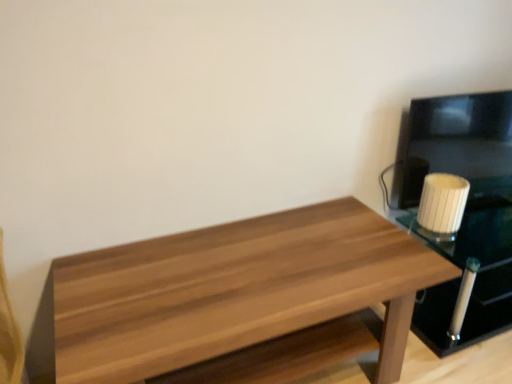
What do you see at coordinates (234, 291) in the screenshot? The image size is (512, 384). I see `wooden table at center` at bounding box center [234, 291].

In order to click on white ribbed glass at right in this screenshot , I will do `click(442, 203)`.

At what (x,y) coordinates should I click in order to perform the action: click on white glossy candle at right. Please return your answer as a coordinate pair (x, y). Image resolution: width=512 pixels, height=384 pixels. Looking at the image, I should click on (465, 210).

Where is `wooden table at center`? wooden table at center is located at coordinates (234, 291).

In terms of size, does white ribbed glass at right appear bigger or smaller than white glossy candle at right?

In the image, white ribbed glass at right appears to be smaller than white glossy candle at right.

Considering the positions of objects white ribbed glass at right and white glossy candle at right in the image provided, who is behind, white ribbed glass at right or white glossy candle at right?

white ribbed glass at right is behind.

Does white ribbed glass at right appear on the right side of white glossy candle at right?

No, white ribbed glass at right is not to the right of white glossy candle at right.

Could you tell me if white ribbed glass at right is facing white glossy candle at right?

No, white ribbed glass at right does not turn towards white glossy candle at right.

Considering the relative positions of white glossy candle at right and white ribbed glass at right in the image provided, is white glossy candle at right to the left of white ribbed glass at right from the viewer's perspective?

In fact, white glossy candle at right is to the right of white ribbed glass at right.

What's the angular difference between white glossy candle at right and white ribbed glass at right's facing directions?

The angular difference between white glossy candle at right and white ribbed glass at right is 5.81 degrees.

Does white glossy candle at right have a larger size compared to white ribbed glass at right?

Indeed, white glossy candle at right has a larger size compared to white ribbed glass at right.

This screenshot has width=512, height=384. What are the coordinates of `table on the left of the white glossy candle at right` in the screenshot? It's located at (234, 291).

Is wooden table at center positioned with its back to white glossy candle at right?

No, wooden table at center is not facing the opposite direction of white glossy candle at right.

Which is less distant, (105, 321) or (457, 255)?

Point (105, 321)

From their relative heights in the image, would you say wooden table at center is taller or shorter than white glossy candle at right?

Considering their sizes, wooden table at center has more height than white glossy candle at right.

Is wooden table at center placed right next to white ribbed glass at right?

No, wooden table at center is not touching white ribbed glass at right.

Considering the sizes of objects wooden table at center and white ribbed glass at right in the image provided, who is shorter, wooden table at center or white ribbed glass at right?

white ribbed glass at right.

From a real-world perspective, is wooden table at center positioned under white ribbed glass at right based on gravity?

Yes.

Would you say wooden table at center is outside white ribbed glass at right?

wooden table at center lies outside white ribbed glass at right's area.

From a real-world perspective, which is physically above, white glossy candle at right or wooden table at center?

wooden table at center is physically above.

Locate an element on the screen. The height and width of the screenshot is (384, 512). entertainment center on the right of wooden table at center is located at coordinates (465, 210).

Is white glossy candle at right in front of or behind wooden table at center in the image?

Visually, white glossy candle at right is located behind wooden table at center.

From a real-world perspective, between white ribbed glass at right and wooden table at center, who is vertically higher?

white ribbed glass at right.

Is white ribbed glass at right wider or thinner than wooden table at center?

white ribbed glass at right is thinner than wooden table at center.

Is white ribbed glass at right directly adjacent to wooden table at center?

No, white ribbed glass at right is not touching wooden table at center.

At what (x,y) coordinates should I click in order to perform the action: click on entertainment center below the white ribbed glass at right (from a real-world perspective). Please return your answer as a coordinate pair (x, y). Looking at the image, I should click on (465, 210).

Identify the location of candle holder above the white glossy candle at right (from a real-world perspective). (442, 203).

From the picture: Which object lies nearer to the anchor point white ribbed glass at right, wooden table at center or white glossy candle at right?

white glossy candle at right is closer to white ribbed glass at right.

Looking at the image, which one is located closer to white glossy candle at right, white ribbed glass at right or wooden table at center?

white ribbed glass at right lies closer to white glossy candle at right than the other object.

From the image, which object appears to be nearer to wooden table at center, white glossy candle at right or white ribbed glass at right?

white ribbed glass at right is positioned closer to the anchor wooden table at center.

Looking at the image, which one is located closer to white ribbed glass at right, white glossy candle at right or wooden table at center?

Among the two, white glossy candle at right is located nearer to white ribbed glass at right.

Estimate the real-world distances between objects in this image. Which object is closer to white glossy candle at right, wooden table at center or white ribbed glass at right?

Among the two, white ribbed glass at right is located nearer to white glossy candle at right.

Based on their spatial positions, is white ribbed glass at right or white glossy candle at right further from wooden table at center?

white glossy candle at right is positioned further to the anchor wooden table at center.

Find the location of `candle holder between wooden table at center and white glossy candle at right`. candle holder between wooden table at center and white glossy candle at right is located at coordinates (442, 203).